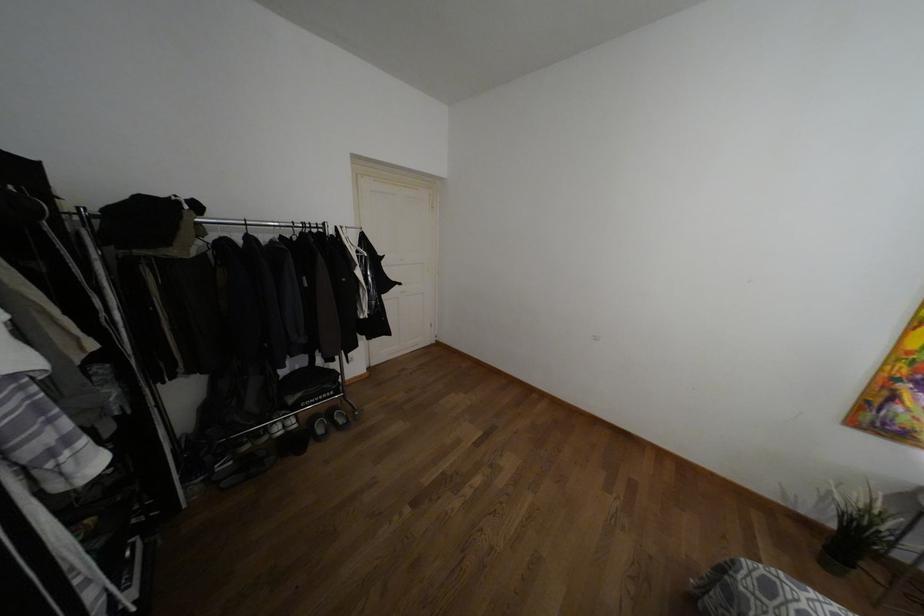
Find where to lift the black plant pot. Please return your answer as a coordinate pair (x, y).

(860, 529)